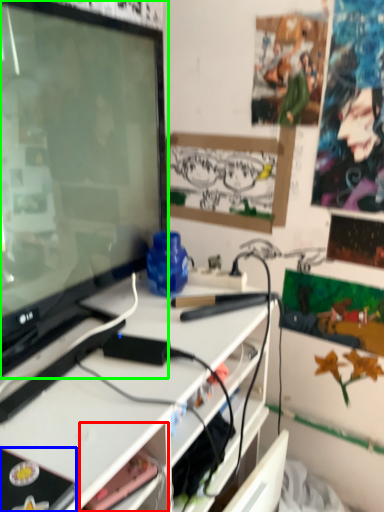
Question: Which object is positioned farthest from shelf (highlighted by a red box)? Select from equipment (highlighted by a blue box) and television (highlighted by a green box).

Choices:
 (A) equipment
 (B) television

Answer: (B)